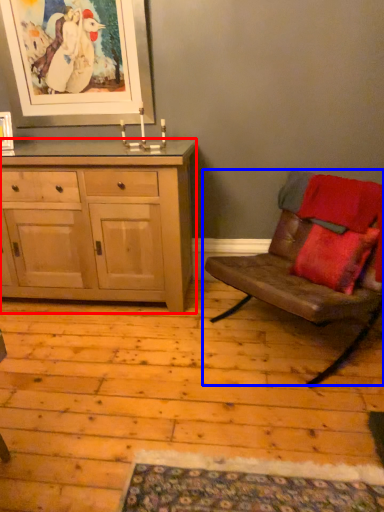
Question: Which of the following is the farthest to the observer, cabinetry (highlighted by a red box) or chair (highlighted by a blue box)?

Choices:
 (A) cabinetry
 (B) chair

Answer: (A)